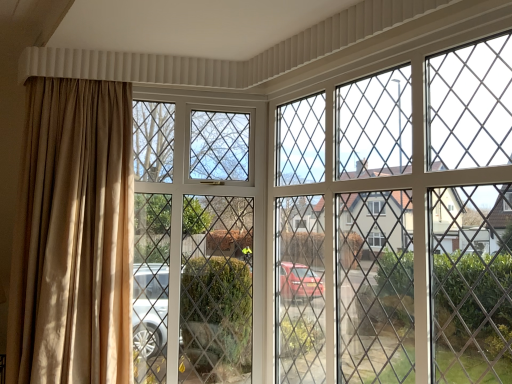
Question: From the image's perspective, is clear glass screen door at center, the 2th screen door viewed from the right, positioned above or below beige fabric curtain at left?

Choices:
 (A) below
 (B) above

Answer: (A)

Question: Based on their positions, is clear glass screen door at center, the 2th screen door viewed from the right, located to the left or right of beige fabric curtain at left?

Choices:
 (A) left
 (B) right

Answer: (B)

Question: Which object is positioned closest to the clear glass screen door at center, the 1th screen door when ordered from left to right?

Choices:
 (A) clear glass screen door at upper center, which is the first screen door from right to left
 (B) beige fabric curtain at left

Answer: (B)

Question: Which object is positioned farthest from the clear glass screen door at center, the 1th screen door when ordered from left to right?

Choices:
 (A) beige fabric curtain at left
 (B) clear glass screen door at upper center, which is the 2th screen door in left-to-right order

Answer: (B)